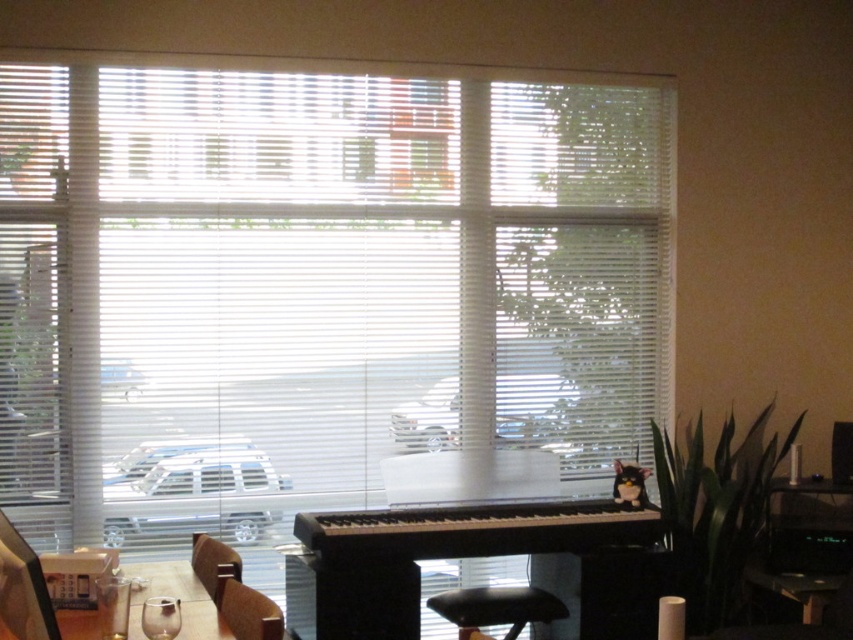
Can you confirm if black polished piano at center is smaller than clear glass wine glass at lower left?

Incorrect, black polished piano at center is not smaller in size than clear glass wine glass at lower left.

Looking at this image, does black polished piano at center appear under clear glass wine glass at lower left?

Yes, black polished piano at center is below clear glass wine glass at lower left.

Which is behind, point (344, 580) or point (126, 589)?

The point (344, 580) is more distant.

Locate an element on the screen. black polished piano at center is located at coordinates (428, 556).

Between wooden armchair at center and transparent glass at lower center, which one appears on the left side from the viewer's perspective?

Positioned to the left is wooden armchair at center.

Is point (238, 570) in front of point (149, 611)?

No, (238, 570) is behind (149, 611).

In order to click on wooden armchair at center in this screenshot , I will do `click(213, 564)`.

Who is positioned more to the left, black leather bar stool at lower center or transparent glass at lower center?

transparent glass at lower center

Measure the distance between black leather bar stool at lower center and transparent glass at lower center.

black leather bar stool at lower center is 1.38 meters from transparent glass at lower center.

The height and width of the screenshot is (640, 853). What do you see at coordinates (497, 608) in the screenshot?
I see `black leather bar stool at lower center` at bounding box center [497, 608].

At what (x,y) coordinates should I click in order to perform the action: click on black leather bar stool at lower center. Please return your answer as a coordinate pair (x, y). Looking at the image, I should click on [497, 608].